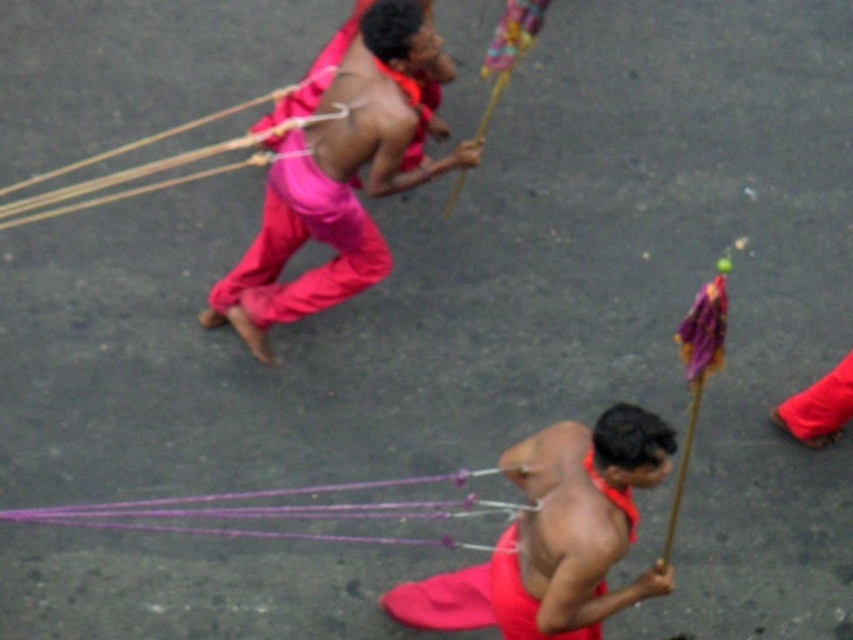
Question: Observing the image, what is the correct spatial positioning of matte pink pants at upper center in reference to purple string at lower center?

Choices:
 (A) left
 (B) right

Answer: (B)

Question: Is matte pink pants at upper center smaller than purple string at lower center?

Choices:
 (A) yes
 (B) no

Answer: (B)

Question: Which of the following is the farthest from the observer?

Choices:
 (A) (263, 236)
 (B) (317, 509)

Answer: (A)

Question: In this image, where is matte pink pants at upper center located relative to purple string at lower center?

Choices:
 (A) left
 (B) right

Answer: (B)

Question: Which object appears farthest from the camera in this image?

Choices:
 (A) matte pink pants at upper center
 (B) purple string at lower center

Answer: (A)

Question: Which point is farther to the camera?

Choices:
 (A) (35, 522)
 (B) (311, 144)

Answer: (B)